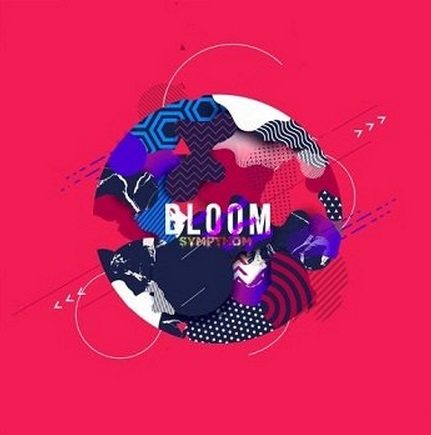
The height and width of the screenshot is (435, 431). In order to click on purple paint splotch in this screenshot , I will do `click(244, 294)`.